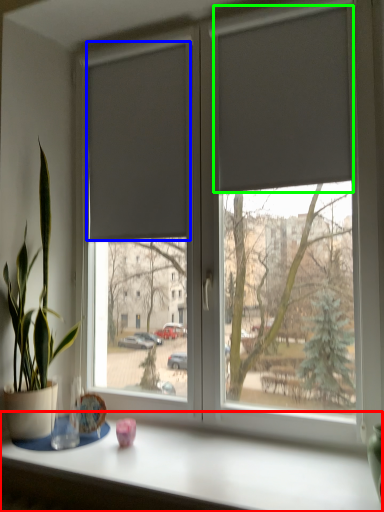
Question: Based on their relative distances, which object is nearer to table (highlighted by a red box)? Choose from curtain (highlighted by a blue box) and curtain (highlighted by a green box).

Choices:
 (A) curtain
 (B) curtain

Answer: (A)